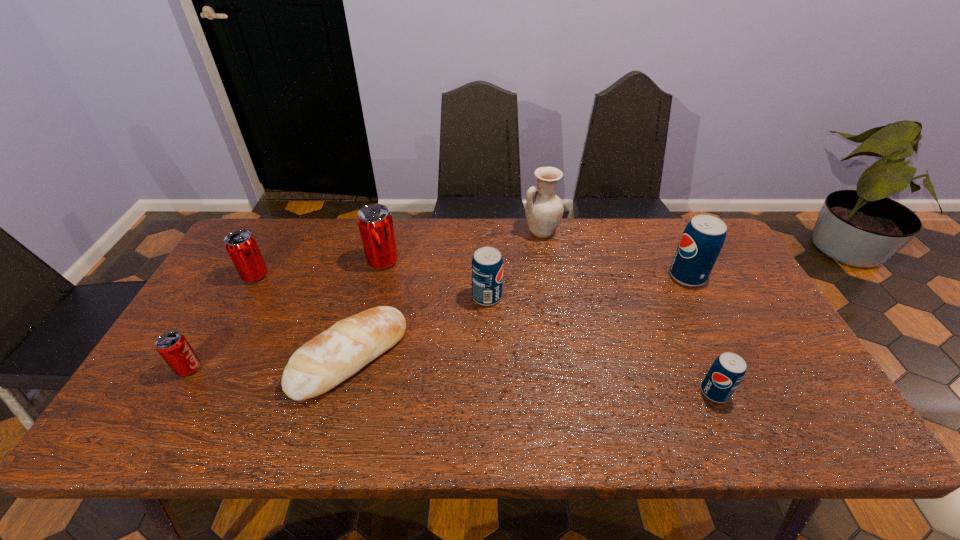
At what (x,y) coordinates should I click in order to perform the action: click on the nearest pop. Please return your answer as a coordinate pair (x, y). Looking at the image, I should click on (727, 371).

The width and height of the screenshot is (960, 540). Identify the location of the nearest blue pop. (727, 371).

Locate an element on the screen. The image size is (960, 540). beige bread is located at coordinates (336, 354).

Find the location of a particular element. This screenshot has width=960, height=540. free space located on the right of the farthest object is located at coordinates (587, 232).

Find the location of a particular element. The image size is (960, 540). blank space located 0.300m on the left of the fourth pop from right to left is located at coordinates (272, 261).

At what (x,y) coordinates should I click in order to perform the action: click on vacant position located 0.060m on the back of the biggest blue pop. Please return your answer as a coordinate pair (x, y). The height and width of the screenshot is (540, 960). Looking at the image, I should click on (675, 252).

The width and height of the screenshot is (960, 540). Identify the location of free space located on the right of the second smallest red soda can. (361, 276).

Identify the location of vacant area situated 0.090m on the right of the third pop from right to left. The width and height of the screenshot is (960, 540). (533, 296).

You are a GUI agent. You are given a task and a screenshot of the screen. Output one action in this format:
    pyautogui.click(x=<x>, y=<y>)
    Task: Click on the blank space located on the back of the smallest red soda can
    This screenshot has width=960, height=540.
    Given the screenshot: What is the action you would take?
    pyautogui.click(x=220, y=314)

This screenshot has width=960, height=540. I want to click on free space located 0.060m on the front of the nearest blue pop, so click(x=731, y=429).